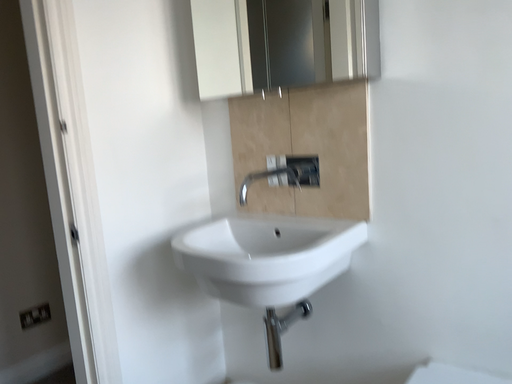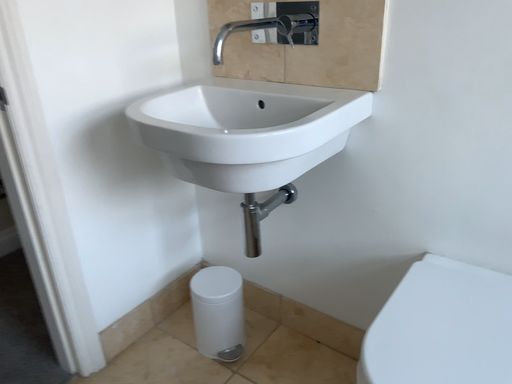
Question: How did the camera likely rotate when shooting the video?

Choices:
 (A) rotated upward
 (B) rotated downward

Answer: (B)